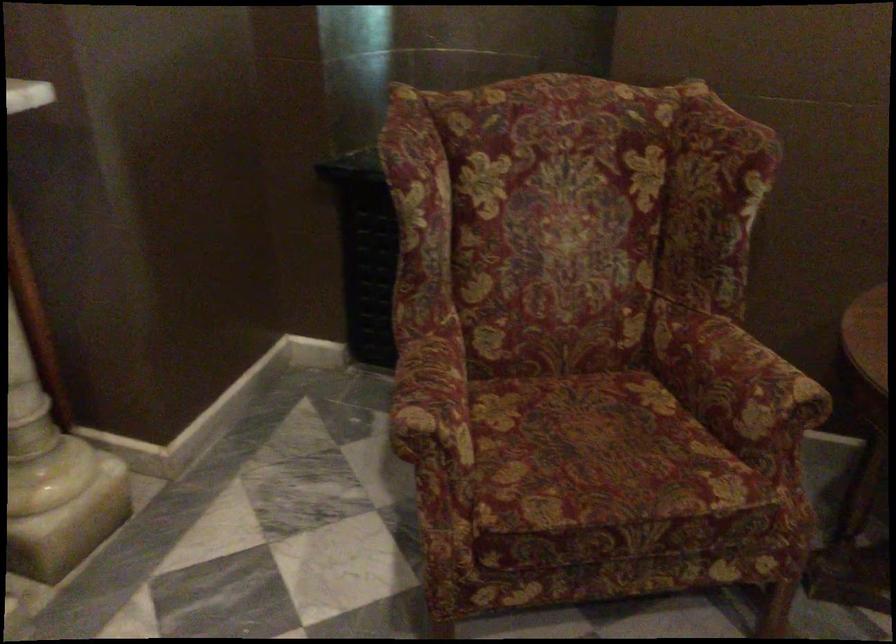
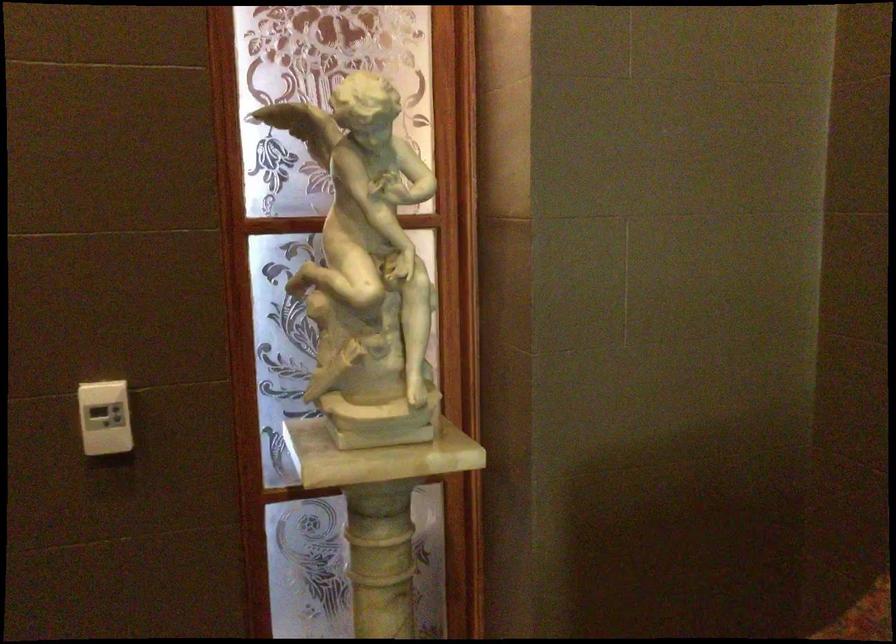
Question: How did the camera likely rotate?

Choices:
 (A) Left
 (B) Right
 (C) Up
 (D) Down

Answer: (A)